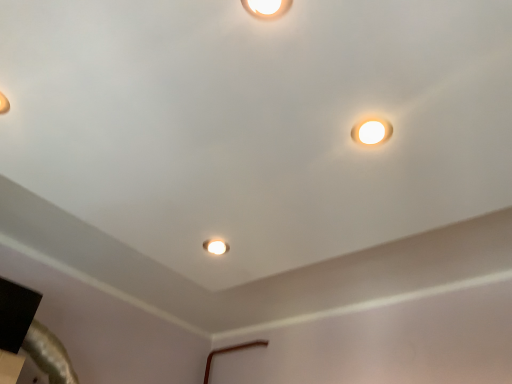
Question: From the image's perspective, would you say matte white ceiling light at center is shown under matte white lamp at upper right?

Choices:
 (A) yes
 (B) no

Answer: (A)

Question: Is matte white ceiling light at center placed right next to matte white lamp at upper right?

Choices:
 (A) no
 (B) yes

Answer: (A)

Question: Is matte white ceiling light at center facing towards matte white lamp at upper right?

Choices:
 (A) no
 (B) yes

Answer: (A)

Question: Is matte white ceiling light at center far from matte white lamp at upper right?

Choices:
 (A) no
 (B) yes

Answer: (A)

Question: Is matte white ceiling light at center thinner than matte white lamp at upper right?

Choices:
 (A) yes
 (B) no

Answer: (A)

Question: Is matte white ceiling light at center positioned with its back to matte white lamp at upper right?

Choices:
 (A) no
 (B) yes

Answer: (A)

Question: Considering the relative sizes of matte white lamp at upper right and matte white ceiling light at center in the image provided, is matte white lamp at upper right thinner than matte white ceiling light at center?

Choices:
 (A) no
 (B) yes

Answer: (A)

Question: Is matte white ceiling light at center inside matte white lamp at upper right?

Choices:
 (A) no
 (B) yes

Answer: (A)

Question: From the image's perspective, is matte white lamp at upper right below matte white ceiling light at center?

Choices:
 (A) yes
 (B) no

Answer: (B)

Question: Does matte white lamp at upper right have a lesser height compared to matte white ceiling light at center?

Choices:
 (A) yes
 (B) no

Answer: (A)

Question: Is matte white lamp at upper right facing towards matte white ceiling light at center?

Choices:
 (A) no
 (B) yes

Answer: (A)

Question: Can you confirm if matte white lamp at upper right is wider than matte white ceiling light at center?

Choices:
 (A) no
 (B) yes

Answer: (B)

Question: Is matte white lamp at upper right situated inside matte white ceiling light at center or outside?

Choices:
 (A) outside
 (B) inside

Answer: (A)